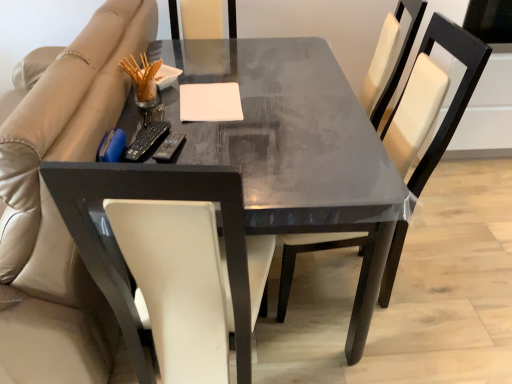
You are a GUI agent. You are given a task and a screenshot of the screen. Output one action in this format:
    pyautogui.click(x=<x>, y=<y>)
    Task: Click on the free spot behind black plastic remote at left
    The width and height of the screenshot is (512, 384).
    Given the screenshot: What is the action you would take?
    pyautogui.click(x=153, y=121)